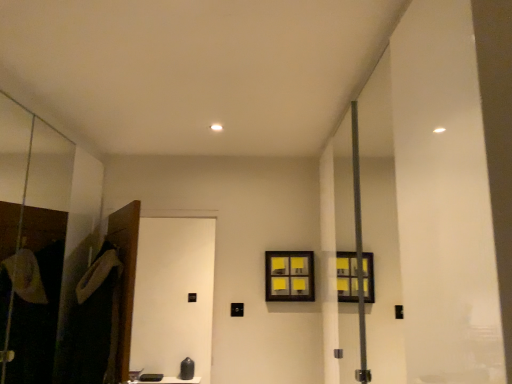
Question: From the image's perspective, is transparent glass screen door at left, the 1th screen door viewed from the left, above yellow sticky notes at center?

Choices:
 (A) yes
 (B) no

Answer: (A)

Question: From a real-world perspective, is transparent glass screen door at left, the 1th screen door viewed from the left, physically above yellow sticky notes at center?

Choices:
 (A) yes
 (B) no

Answer: (A)

Question: Is transparent glass screen door at left, the 1th screen door viewed from the left, not within yellow sticky notes at center?

Choices:
 (A) no
 (B) yes

Answer: (B)

Question: Is transparent glass screen door at left, the 1th screen door viewed from the left, taller than yellow sticky notes at center?

Choices:
 (A) no
 (B) yes

Answer: (B)

Question: Is yellow sticky notes at center completely or partially inside transparent glass screen door at left, the 1th screen door viewed from the left?

Choices:
 (A) no
 (B) yes

Answer: (A)

Question: From the image's perspective, is dark gray fabric robe at left above or below transparent glass screen door at left, the 1th screen door viewed from the left?

Choices:
 (A) below
 (B) above

Answer: (A)

Question: From a real-world perspective, is dark gray fabric robe at left positioned above or below transparent glass screen door at left, marked as the 2th screen door in a right-to-left arrangement?

Choices:
 (A) above
 (B) below

Answer: (B)

Question: Based on their positions, is dark gray fabric robe at left located to the left or right of transparent glass screen door at left, marked as the 2th screen door in a right-to-left arrangement?

Choices:
 (A) left
 (B) right

Answer: (B)

Question: Is dark gray fabric robe at left in front of or behind transparent glass screen door at left, the 1th screen door viewed from the left, in the image?

Choices:
 (A) front
 (B) behind

Answer: (B)

Question: From their relative heights in the image, would you say yellow sticky notes at center is taller or shorter than transparent glass screen door at left, the 1th screen door viewed from the left?

Choices:
 (A) short
 (B) tall

Answer: (A)

Question: From the image's perspective, is yellow sticky notes at center above or below transparent glass screen door at left, marked as the 2th screen door in a right-to-left arrangement?

Choices:
 (A) below
 (B) above

Answer: (A)

Question: Is yellow sticky notes at center inside or outside of transparent glass screen door at left, marked as the 2th screen door in a right-to-left arrangement?

Choices:
 (A) inside
 (B) outside

Answer: (B)

Question: From a real-world perspective, is yellow sticky notes at center physically located above or below transparent glass screen door at left, marked as the 2th screen door in a right-to-left arrangement?

Choices:
 (A) below
 (B) above

Answer: (A)

Question: In the image, is black matte screen door at lower left, which appears as the 1th screen door when viewed from the right, positioned in front of or behind yellow sticky notes at center?

Choices:
 (A) behind
 (B) front

Answer: (B)

Question: From a real-world perspective, is black matte screen door at lower left, which appears as the 1th screen door when viewed from the right, above or below yellow sticky notes at center?

Choices:
 (A) above
 (B) below

Answer: (B)